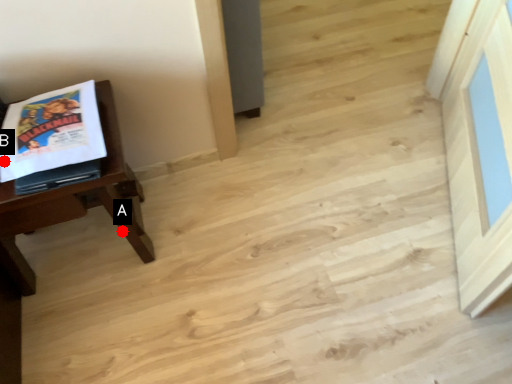
Question: Two points are circled on the image, labeled by A and B beside each circle. Which of the following is the farthest from the observer?

Choices:
 (A) A is further
 (B) B is further

Answer: (A)